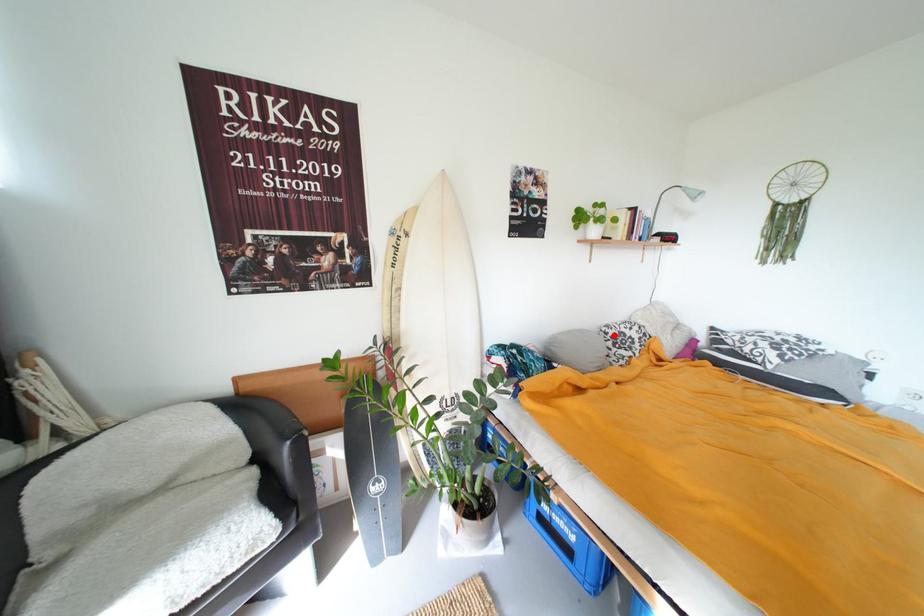
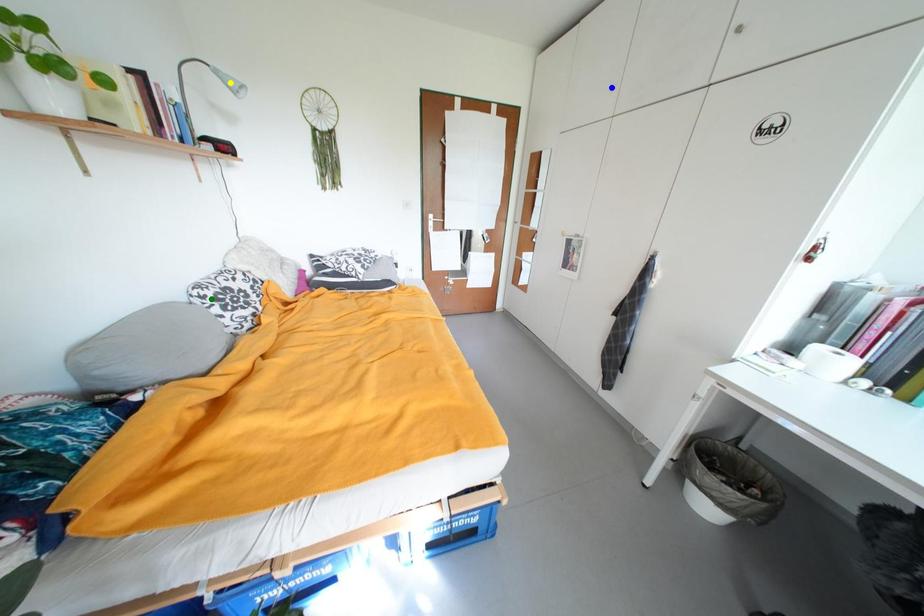
Question: I am providing you with two images of the same scene from different viewpoints. A red point is marked on the first image. You are given multiple points on the second image. Can you choose the point in image 2 that corresponds to the point in image 1?

Choices:
 (A) blue point
 (B) green point
 (C) yellow point

Answer: (B)